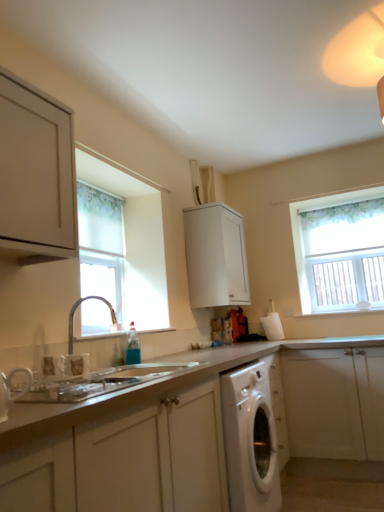
Question: Considering the positions of point click(x=109, y=309) and point click(x=122, y=441), is point click(x=109, y=309) closer or farther from the camera than point click(x=122, y=441)?

Choices:
 (A) closer
 (B) farther

Answer: (B)

Question: Considering the positions of silver metallic tap at lower left and white matte cabinet at lower center, the fourth cabinetry when ordered from back to front, in the image, is silver metallic tap at lower left wider or thinner than white matte cabinet at lower center, the fourth cabinetry when ordered from back to front,?

Choices:
 (A) wide
 (B) thin

Answer: (B)

Question: Estimate the real-world distances between objects in this image. Which object is farther from the white glossy washing machine at lower center?

Choices:
 (A) white matte cabinet at center, which is the first cabinetry from back to front
 (B) white fabric window at left, which is counted as the second window, starting from the right
 (C) matte white cabinet at upper left, the 2th cabinetry when ordered from front to back
 (D) white textured window at upper right, the second window viewed from the front
 (E) silver metallic tap at lower left

Answer: (D)

Question: Estimate the real-world distances between objects in this image. Which object is farther from the white matte cabinet at lower right, positioned as the 2th cabinetry in back-to-front order?

Choices:
 (A) white glossy washing machine at lower center
 (B) white textured window at upper right, the first window in the right-to-left sequence
 (C) white fabric window at left, which is counted as the second window, starting from the right
 (D) matte white cabinet at upper left, the 2th cabinetry when ordered from front to back
 (E) white matte cabinet at lower center, the fourth cabinetry when ordered from back to front

Answer: (D)